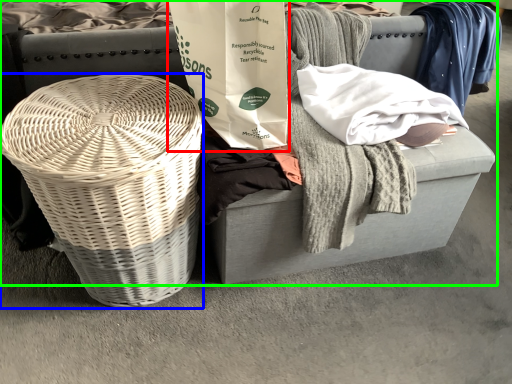
Question: Considering the real-world distances, which object is closest to shopping bag (highlighted by a red box)? basket (highlighted by a blue box) or furniture (highlighted by a green box).

Choices:
 (A) basket
 (B) furniture

Answer: (A)